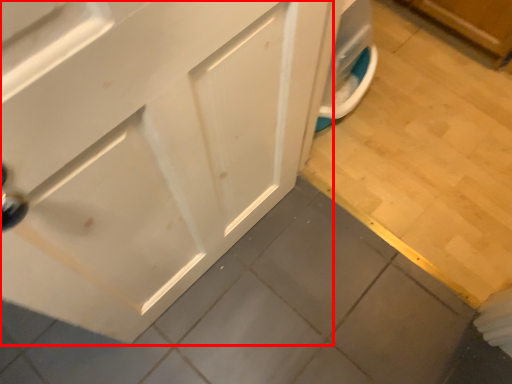
Question: From the image's perspective, where is cabinetry (annotated by the red box) located in relation to tile in the image?

Choices:
 (A) below
 (B) above

Answer: (A)